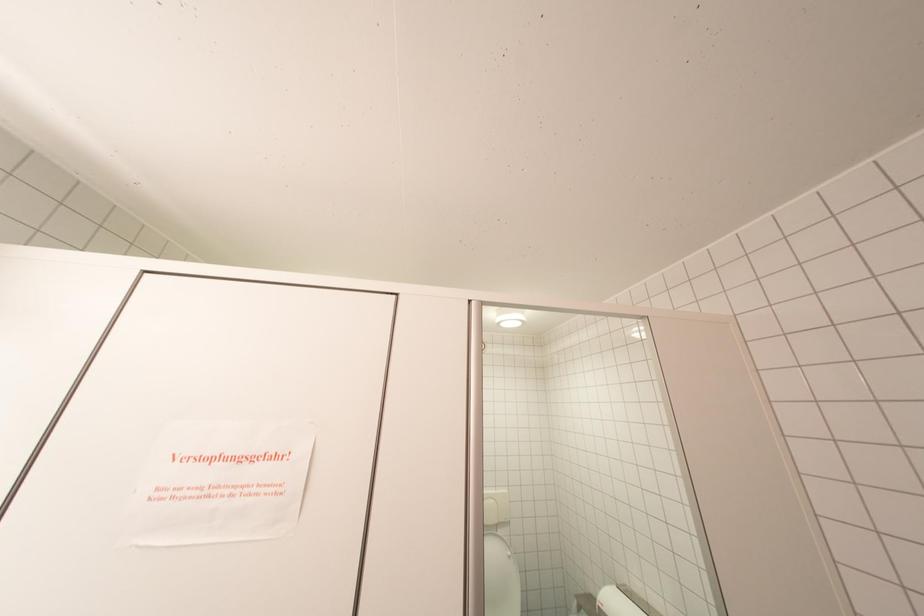
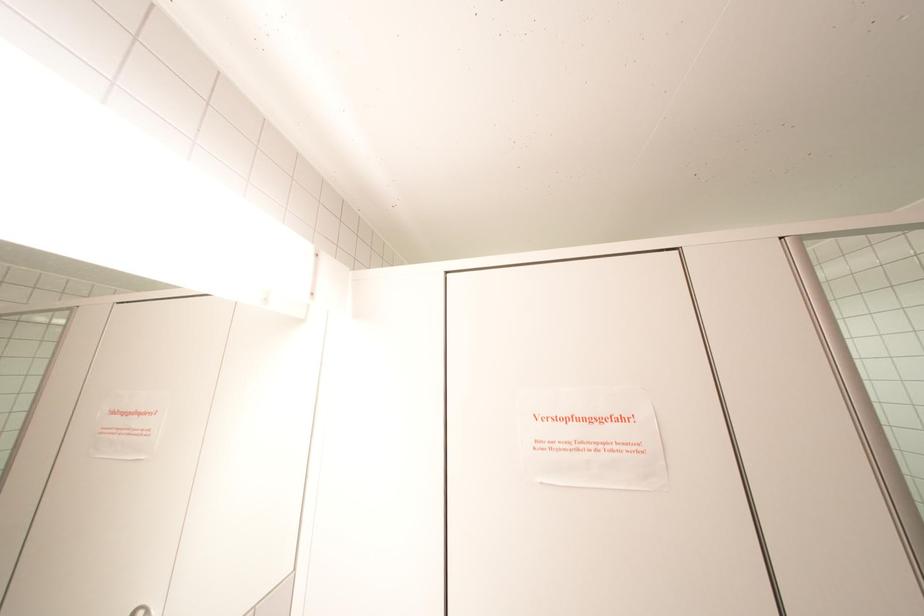
Question: The images are taken continuously from a first-person perspective. In which direction are you moving?

Choices:
 (A) Left
 (B) Right
 (C) Forward
 (D) Backward

Answer: (A)